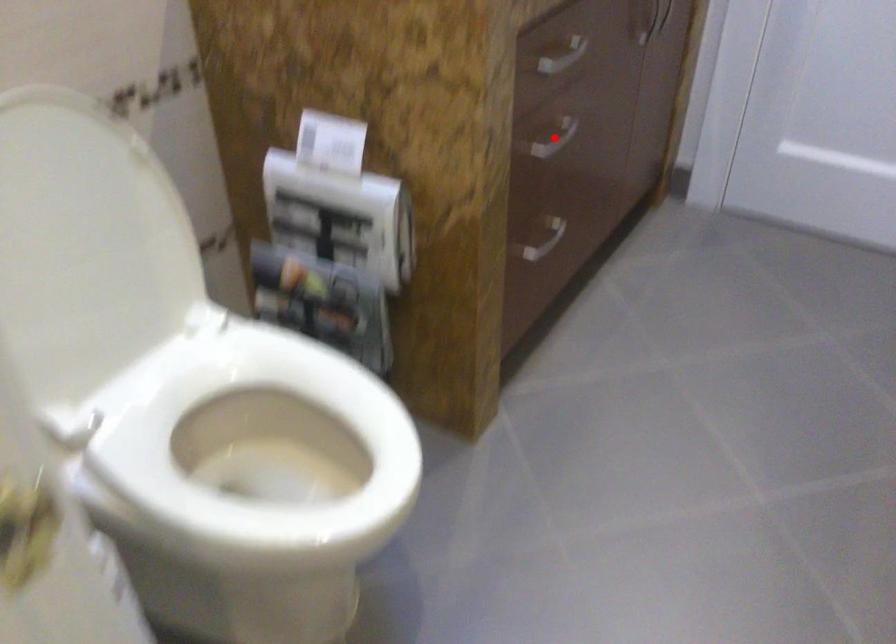
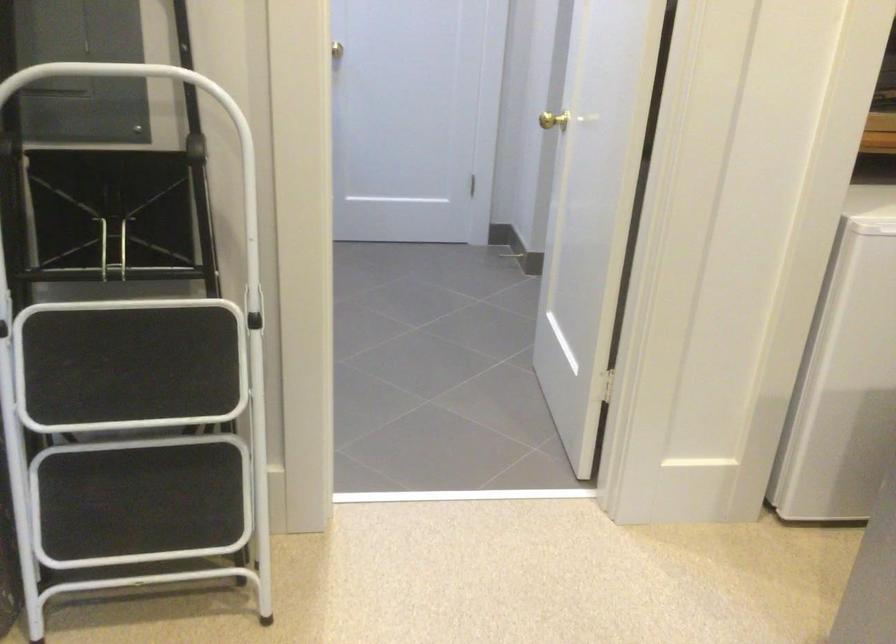
Question: I am providing you with two images of the same scene from different viewpoints. A red point is marked on the first image. Is the red point's position out of view in image 2?

Choices:
 (A) Yes
 (B) No

Answer: (A)